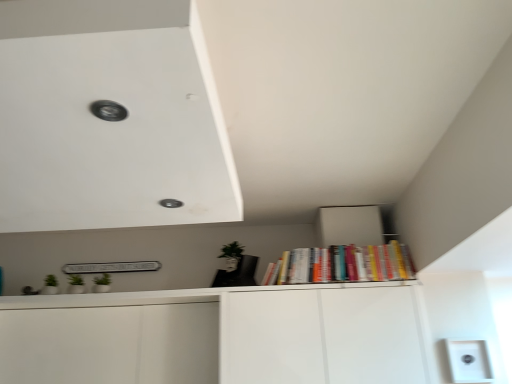
Question: Is white plastic light switch at lower right bigger than hardcover books at upper right?

Choices:
 (A) no
 (B) yes

Answer: (A)

Question: Is white plastic light switch at lower right beside hardcover books at upper right?

Choices:
 (A) yes
 (B) no

Answer: (B)

Question: Can you confirm if white plastic light switch at lower right is positioned to the right of hardcover books at upper right?

Choices:
 (A) yes
 (B) no

Answer: (A)

Question: Are white plastic light switch at lower right and hardcover books at upper right far apart?

Choices:
 (A) yes
 (B) no

Answer: (B)

Question: Considering the relative sizes of white plastic light switch at lower right and hardcover books at upper right in the image provided, is white plastic light switch at lower right taller than hardcover books at upper right?

Choices:
 (A) no
 (B) yes

Answer: (A)

Question: Can you confirm if white plastic light switch at lower right is smaller than hardcover books at upper right?

Choices:
 (A) yes
 (B) no

Answer: (A)

Question: Is hardcover books at upper right outside white plastic light switch at lower right?

Choices:
 (A) yes
 (B) no

Answer: (A)

Question: Does hardcover books at upper right lie in front of white plastic light switch at lower right?

Choices:
 (A) yes
 (B) no

Answer: (B)

Question: From the image's perspective, does hardcover books at upper right appear lower than white plastic light switch at lower right?

Choices:
 (A) no
 (B) yes

Answer: (A)

Question: Is hardcover books at upper right oriented towards white plastic light switch at lower right?

Choices:
 (A) no
 (B) yes

Answer: (A)

Question: Does hardcover books at upper right have a smaller size compared to white plastic light switch at lower right?

Choices:
 (A) no
 (B) yes

Answer: (A)

Question: Is hardcover books at upper right touching white plastic light switch at lower right?

Choices:
 (A) yes
 (B) no

Answer: (B)

Question: Looking at their shapes, would you say white plastic light switch at lower right is wider or thinner than hardcover books at upper right?

Choices:
 (A) wide
 (B) thin

Answer: (B)